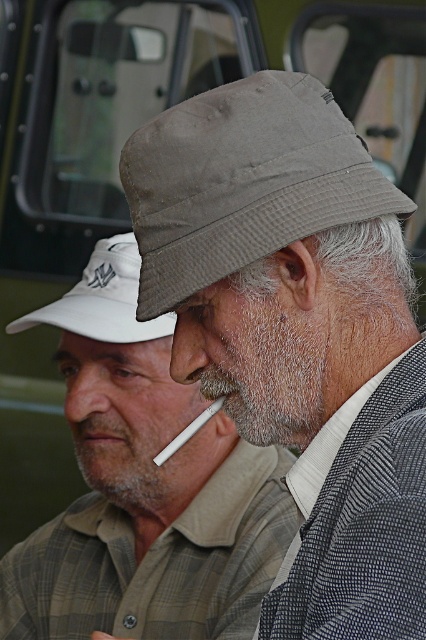
Can you confirm if khaki fabric bucket hat at center is shorter than white fabric cap at upper left?

No, khaki fabric bucket hat at center is not shorter than white fabric cap at upper left.

Describe the element at coordinates (244, 180) in the screenshot. I see `khaki fabric bucket hat at center` at that location.

What do you see at coordinates (244, 180) in the screenshot?
I see `khaki fabric bucket hat at center` at bounding box center [244, 180].

Where is `khaki fabric bucket hat at center`? khaki fabric bucket hat at center is located at coordinates (244, 180).

Who is lower down, gray fabric hat at center or gray fabric hat at upper center?

Positioned lower is gray fabric hat at upper center.

Does gray fabric hat at center come behind gray fabric hat at upper center?

No.

Between point (307, 435) and point (129, 534), which one is positioned in front?

Positioned in front is point (307, 435).

At what (x,y) coordinates should I click in order to perform the action: click on gray fabric hat at center. Please return your answer as a coordinate pair (x, y). The width and height of the screenshot is (426, 640). Looking at the image, I should click on (299, 332).

Between point (249, 173) and point (189, 371), which one is positioned in front?

Positioned in front is point (249, 173).

The width and height of the screenshot is (426, 640). What do you see at coordinates (244, 180) in the screenshot?
I see `khaki fabric bucket hat at center` at bounding box center [244, 180].

This screenshot has width=426, height=640. I want to click on khaki fabric bucket hat at center, so click(244, 180).